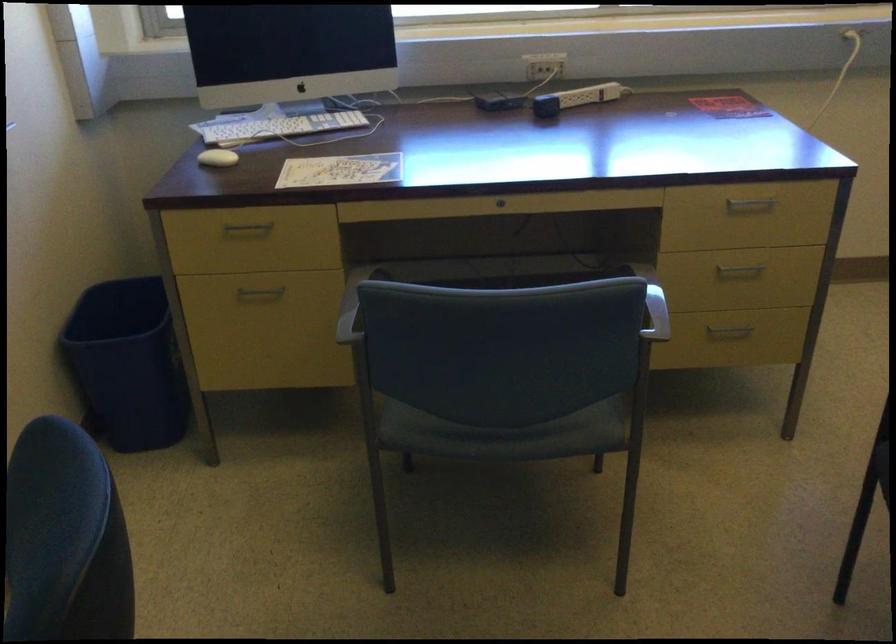
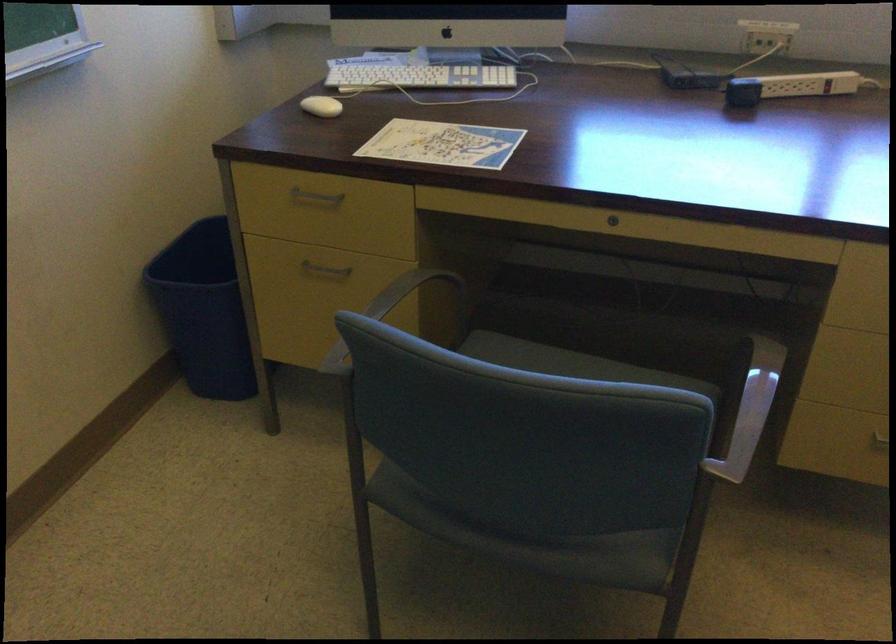
Find the pixel in the second image that matches point 528,437 in the first image.

(538, 542)